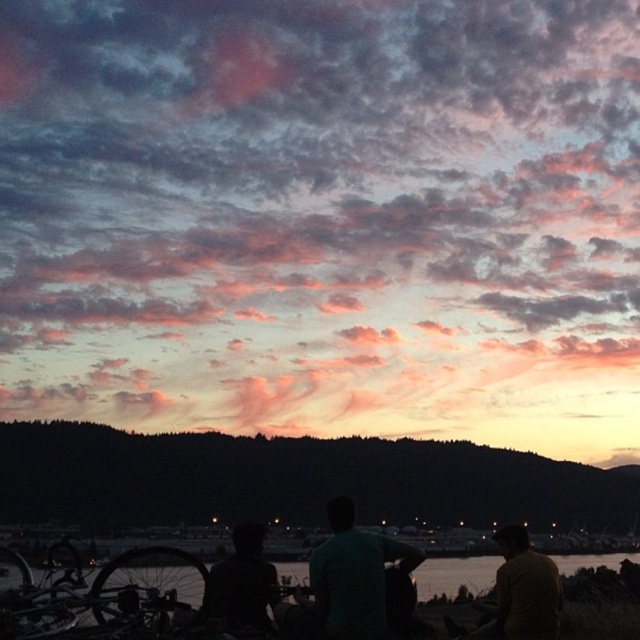
You are an observer looking at the sunset scene. There is a green matte shirt at center and a silhouette figure at center. Which object has a greater width?

The green matte shirt at center has a greater width than the silhouette figure at center.

You are a photographer trying to capture the sunset scene. You notice the green matte shirt at center and the transparent water at lower center. Which object is positioned higher in the image?

The green matte shirt at center is positioned higher in the image as it is above the transparent water at lower center.

You are a photographer trying to capture the sunset scene. You notice two subjects in the frame, the green matte shirt at center and the silhouette figure at center. Which subject is positioned more to the east side of the frame?

The silhouette figure at center is positioned more to the east side of the frame because the green matte shirt at center is to the right of it, and since the sunset is in the west, the right side of the frame corresponds to the west direction, making the silhouette figure at center closer to the east.